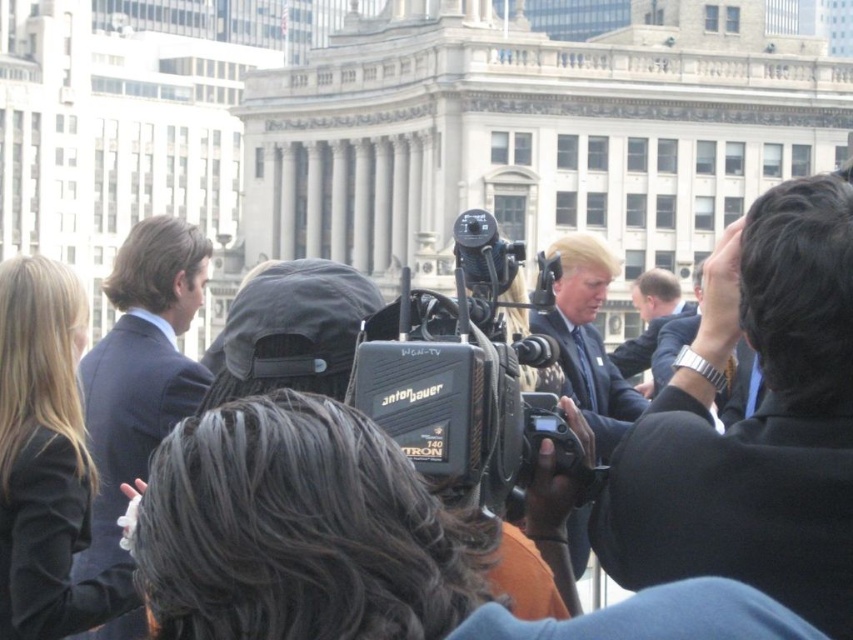
Question: In this image, where is dark blue suit at left located relative to light brown suit at center?

Choices:
 (A) left
 (B) right

Answer: (A)

Question: Does black suit at upper right appear over silver metallic watch at upper right?

Choices:
 (A) no
 (B) yes

Answer: (A)

Question: Considering the real-world distances, which object is closest to the dark blue suit at left?

Choices:
 (A) light brown suit at center
 (B) black suit at upper right
 (C) silver metallic watch at upper right

Answer: (B)

Question: Which point is closer to the camera taking this photo?

Choices:
 (A) (723, 397)
 (B) (645, 323)
 (C) (123, 248)
 (D) (822, 417)

Answer: (D)

Question: Does black suit at upper right appear over dark blue suit at left?

Choices:
 (A) no
 (B) yes

Answer: (A)

Question: Considering the real-world distances, which object is closest to the silver metallic watch at upper right?

Choices:
 (A) dark blue suit at left
 (B) black suit at upper right

Answer: (B)